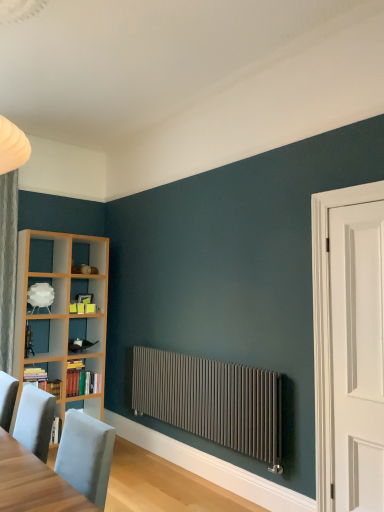
Question: Does point (79, 374) appear closer or farther from the camera than point (238, 415)?

Choices:
 (A) closer
 (B) farther

Answer: (B)

Question: Is hardcover books at left, which is the 1th book in back-to-front order, to the left or to the right of matte gray radiator at center in the image?

Choices:
 (A) left
 (B) right

Answer: (A)

Question: Based on their relative distances, which object is farther from the hardcover books at left, which is the 1th book in back-to-front order?

Choices:
 (A) white matte lampshade at left
 (B) white matte door at right
 (C) light gray fabric chair at lower left
 (D) light gray wood table at lower left
 (E) matte gray radiator at center

Answer: (B)

Question: Considering the real-world distances, which object is farthest from the white matte door at right?

Choices:
 (A) matte gray radiator at center
 (B) light gray wood table at lower left
 (C) white matte lampshade at left
 (D) hardcover books at left, which is the 1th book in back-to-front order
 (E) light gray fabric chair at lower left

Answer: (C)